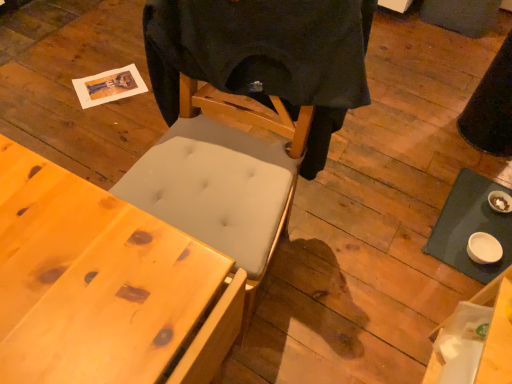
You are a GUI agent. You are given a task and a screenshot of the screen. Output one action in this format:
    pyautogui.click(x=<x>, y=<y>)
    Task: Click on the wooden desk at lower left
    Image resolution: width=512 pixels, height=384 pixels.
    Given the screenshot: What is the action you would take?
    pyautogui.click(x=103, y=285)

What do you see at coordinates (470, 226) in the screenshot? The image size is (512, 384). I see `white matte table at lower right` at bounding box center [470, 226].

The width and height of the screenshot is (512, 384). In order to click on wooden desk at lower left in this screenshot , I will do `click(103, 285)`.

How much distance is there between wooden desk at lower left and white matte table at lower right?

A distance of 3.92 feet exists between wooden desk at lower left and white matte table at lower right.

From the image's perspective, between wooden desk at lower left and white matte table at lower right, who is located below?

wooden desk at lower left.

Does wooden desk at lower left appear on the right side of white matte table at lower right?

Incorrect, wooden desk at lower left is not on the right side of white matte table at lower right.

In terms of height, does wooden desk at lower left look taller or shorter compared to white matte table at lower right?

Considering their sizes, wooden desk at lower left has more height than white matte table at lower right.

Is white matte table at lower right far away from black matte t-shirt at center?

No.

Is point (461, 206) closer or farther from the camera than point (296, 17)?

Point (461, 206) is farther from the camera than point (296, 17).

Who is shorter, white matte table at lower right or black matte t-shirt at center?

white matte table at lower right is shorter.

Is white matte table at lower right looking in the opposite direction of black matte t-shirt at center?

No, white matte table at lower right's orientation is not away from black matte t-shirt at center.

Can you tell me how much wooden desk at lower left and black matte t-shirt at center differ in facing direction?

There is a 173-degree angle between the facing directions of wooden desk at lower left and black matte t-shirt at center.

Can you confirm if wooden desk at lower left is wider than black matte t-shirt at center?

Correct, the width of wooden desk at lower left exceeds that of black matte t-shirt at center.

From a real-world perspective, is wooden desk at lower left physically above black matte t-shirt at center?

Incorrect, from a real-world perspective, wooden desk at lower left is lower than black matte t-shirt at center.

Between wooden desk at lower left and black matte t-shirt at center, which one has larger size?

wooden desk at lower left is bigger.

From a real-world perspective, relative to wooden desk at lower left, is black matte t-shirt at center vertically above or below?

black matte t-shirt at center is above wooden desk at lower left.

Looking at this image, which object is wider, black matte t-shirt at center or wooden desk at lower left?

wooden desk at lower left.

Could you tell me if black matte t-shirt at center is facing wooden desk at lower left?

Yes.

You are a GUI agent. You are given a task and a screenshot of the screen. Output one action in this format:
    pyautogui.click(x=<x>, y=<y>)
    Task: Click on the desk to the left of black matte t-shirt at center
    The width and height of the screenshot is (512, 384).
    Given the screenshot: What is the action you would take?
    pyautogui.click(x=103, y=285)

Is black matte t-shirt at center thinner than white matte table at lower right?

Yes, black matte t-shirt at center is thinner than white matte table at lower right.

Based on the photo, relative to white matte table at lower right, is black matte t-shirt at center in front or behind?

black matte t-shirt at center is positioned closer to the viewer than white matte table at lower right.

From a real-world perspective, is black matte t-shirt at center physically located above or below white matte table at lower right?

From a real-world perspective, black matte t-shirt at center is physically above white matte table at lower right.

From the image's perspective, which object appears higher, white matte table at lower right or wooden desk at lower left?

white matte table at lower right is shown above in the image.

Does white matte table at lower right have a greater width compared to wooden desk at lower left?

Incorrect, the width of white matte table at lower right does not surpass that of wooden desk at lower left.

From a real-world perspective, does white matte table at lower right stand above wooden desk at lower left?

No.

Considering the sizes of white matte table at lower right and wooden desk at lower left in the image, is white matte table at lower right bigger or smaller than wooden desk at lower left?

In the image, white matte table at lower right appears to be smaller than wooden desk at lower left.

The width and height of the screenshot is (512, 384). I want to click on table below the wooden desk at lower left (from a real-world perspective), so click(470, 226).

Where is `cloth above the white matte table at lower right (from the image's perspective)`? The image size is (512, 384). cloth above the white matte table at lower right (from the image's perspective) is located at coordinates (265, 57).

From the image, which object appears to be farther from black matte t-shirt at center, white matte table at lower right or wooden desk at lower left?

white matte table at lower right lies further to black matte t-shirt at center than the other object.

Looking at the image, which one is located further to black matte t-shirt at center, wooden desk at lower left or white matte table at lower right?

white matte table at lower right is further to black matte t-shirt at center.

Considering their positions, is white matte table at lower right positioned closer to wooden desk at lower left than black matte t-shirt at center?

black matte t-shirt at center is positioned closer to the anchor wooden desk at lower left.

In the scene shown: From the image, which object appears to be nearer to wooden desk at lower left, black matte t-shirt at center or white matte table at lower right?

Based on the image, black matte t-shirt at center appears to be nearer to wooden desk at lower left.

Considering their positions, is black matte t-shirt at center positioned closer to white matte table at lower right than wooden desk at lower left?

The object closer to white matte table at lower right is black matte t-shirt at center.

When comparing their distances from white matte table at lower right, does wooden desk at lower left or black matte t-shirt at center seem further?

Among the two, wooden desk at lower left is located further to white matte table at lower right.

You are a GUI agent. You are given a task and a screenshot of the screen. Output one action in this format:
    pyautogui.click(x=<x>, y=<y>)
    Task: Click on the cloth between wooden desk at lower left and white matte table at lower right from left to right
    Image resolution: width=512 pixels, height=384 pixels.
    Given the screenshot: What is the action you would take?
    pyautogui.click(x=265, y=57)